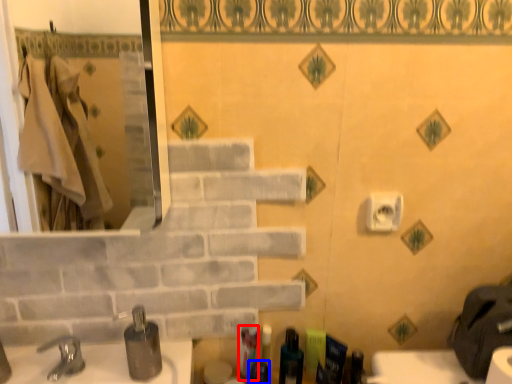
Question: Which of the following is the closest to the observer, toiletry (highlighted by a red box) or toiletry (highlighted by a blue box)?

Choices:
 (A) toiletry
 (B) toiletry

Answer: (B)